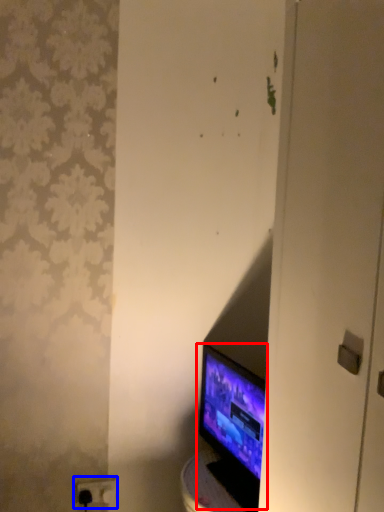
Question: Which point is further to the camera, computer monitor (highlighted by a red box) or electric outlet (highlighted by a blue box)?

Choices:
 (A) computer monitor
 (B) electric outlet

Answer: (B)